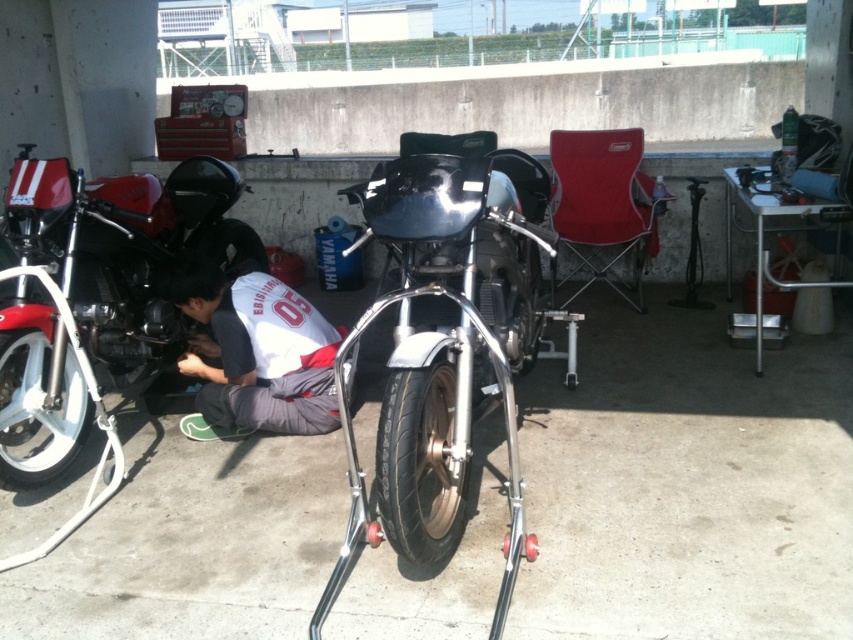
Who is positioned more to the right, black rubber tire at center or white rubber tire at lower left?

black rubber tire at center is more to the right.

Is point (453, 381) farther from viewer compared to point (4, 436)?

That is False.

The height and width of the screenshot is (640, 853). Describe the element at coordinates (421, 464) in the screenshot. I see `black rubber tire at center` at that location.

At what (x,y) coordinates should I click in order to perform the action: click on black rubber tire at center. Please return your answer as a coordinate pair (x, y). Looking at the image, I should click on (421, 464).

Is point (235, 420) behind point (57, 428)?

Yes, it is behind point (57, 428).

Describe the element at coordinates (254, 349) in the screenshot. I see `white fabric shirt at lower center` at that location.

What are the coordinates of `white fabric shirt at lower center` in the screenshot? It's located at (254, 349).

Based on the photo, who is more distant from viewer, [408,323] or [428,452]?

Positioned behind is point [408,323].

Is point (405, 200) farther from camera compared to point (424, 410)?

No, (405, 200) is in front of (424, 410).

You are a GUI agent. You are given a task and a screenshot of the screen. Output one action in this format:
    pyautogui.click(x=<x>, y=<y>)
    Task: Click on the shiny chrome motorcycle at center
    
    Given the screenshot: What is the action you would take?
    pyautogui.click(x=450, y=317)